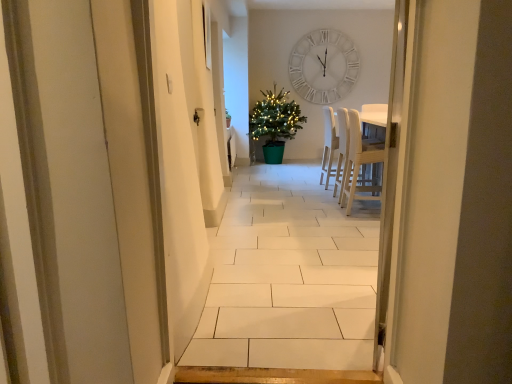
Question: Is light wood chair at center shorter than white wood chairs at center?

Choices:
 (A) yes
 (B) no

Answer: (A)

Question: Considering the relative sizes of light wood chair at center and white wood chairs at center in the image provided, is light wood chair at center taller than white wood chairs at center?

Choices:
 (A) no
 (B) yes

Answer: (A)

Question: Considering the relative positions of light wood chair at center and white wood chairs at center in the image provided, is light wood chair at center in front of white wood chairs at center?

Choices:
 (A) yes
 (B) no

Answer: (A)

Question: Considering the relative sizes of light wood chair at center and white wood chairs at center in the image provided, is light wood chair at center smaller than white wood chairs at center?

Choices:
 (A) no
 (B) yes

Answer: (B)

Question: From a real-world perspective, is light wood chair at center physically below white wood chairs at center?

Choices:
 (A) no
 (B) yes

Answer: (A)

Question: Considering the relative positions of light wood chair at center and green matte potted plant at center in the image provided, is light wood chair at center to the left or to the right of green matte potted plant at center?

Choices:
 (A) left
 (B) right

Answer: (B)

Question: From a real-world perspective, relative to green matte potted plant at center, is light wood chair at center vertically above or below?

Choices:
 (A) below
 (B) above

Answer: (A)

Question: Is light wood chair at center bigger or smaller than green matte potted plant at center?

Choices:
 (A) big
 (B) small

Answer: (B)

Question: Considering the positions of light wood chair at center and green matte potted plant at center in the image, is light wood chair at center wider or thinner than green matte potted plant at center?

Choices:
 (A) thin
 (B) wide

Answer: (A)

Question: From their relative heights in the image, would you say white wooden clock at upper center is taller or shorter than green matte potted plant at center?

Choices:
 (A) tall
 (B) short

Answer: (B)

Question: Is white wooden clock at upper center wider or thinner than green matte potted plant at center?

Choices:
 (A) thin
 (B) wide

Answer: (A)

Question: Visually, is white wooden clock at upper center positioned to the left or to the right of green matte potted plant at center?

Choices:
 (A) left
 (B) right

Answer: (B)

Question: Considering the positions of point (337, 51) and point (278, 107), is point (337, 51) closer or farther from the camera than point (278, 107)?

Choices:
 (A) farther
 (B) closer

Answer: (B)

Question: Does point coord(294,104) appear closer or farther from the camera than point coord(364,198)?

Choices:
 (A) closer
 (B) farther

Answer: (B)

Question: In terms of size, does green matte potted plant at center appear bigger or smaller than light wood chair at center?

Choices:
 (A) big
 (B) small

Answer: (A)